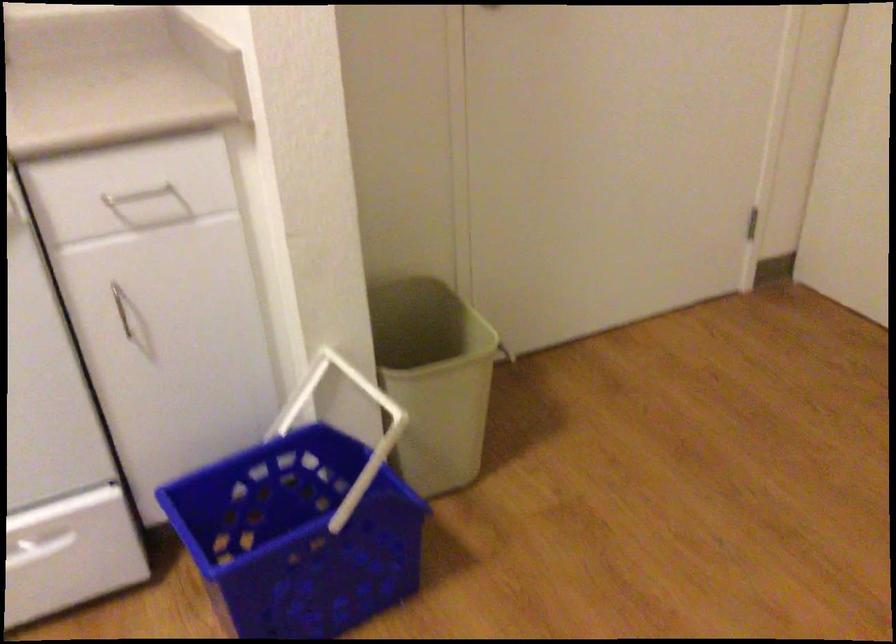
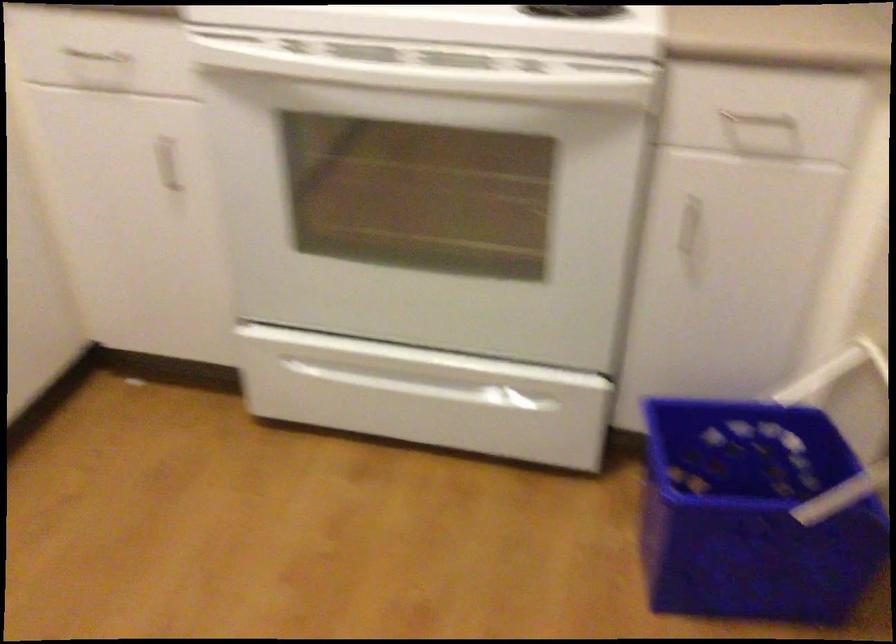
In the second image, find the point that corresponds to (304,547) in the first image.

(752, 514)